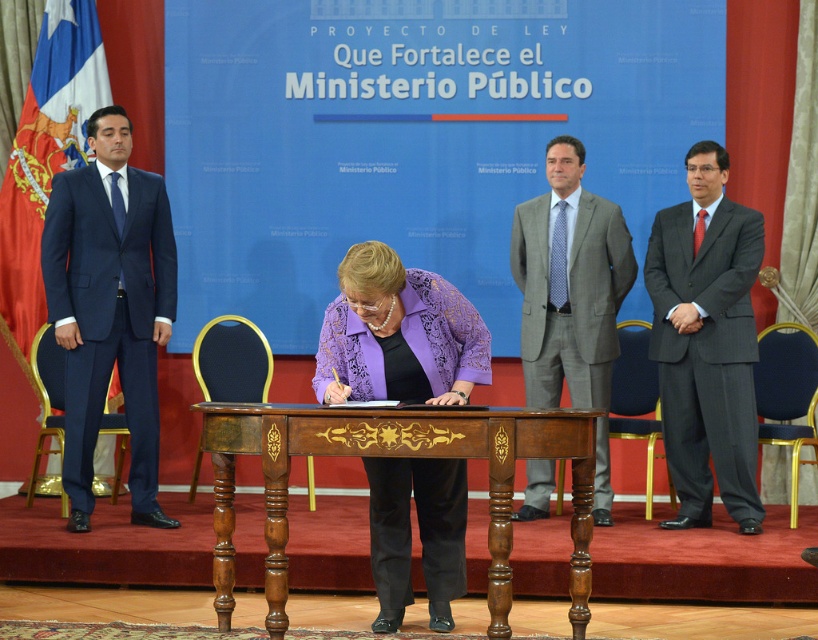
You are an event organizer and need to seat two guests at a narrow table. The navy blue suit at left and the purple textured blouse at center are already seated. Can both guests stay seated without moving, considering the table width?

The navy blue suit at left is thinner than the purple textured blouse at center, so there is enough space for both guests to remain seated at the narrow table without moving.

You are organizing a seating arrangement for an official ceremony. You have two attendees wearing the navy blue suit at left and the gray textured suit at center. The chairs available are standard width. Which attendee should you seat first to ensure they have enough space?

The gray textured suit at center requires more space due to its wider width compared to the navy blue suit at left. Seat the attendee in the gray textured suit at center first to ensure adequate seating space.